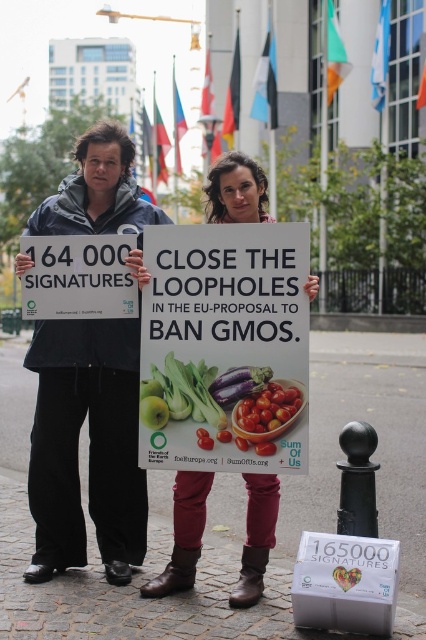
Between matte plastic sign at center and green matte apple at center, which one appears on the left side from the viewer's perspective?

Positioned to the left is green matte apple at center.

Is point (307, 426) closer to camera compared to point (166, 417)?

Yes, point (307, 426) is in front of point (166, 417).

Is point (287, 339) more distant than point (154, 408)?

No, it is in front of (154, 408).

The height and width of the screenshot is (640, 426). In order to click on matte plastic sign at center in this screenshot , I will do `click(226, 348)`.

Does matte plastic sign at center appear on the right side of matte purple eggplant at center?

In fact, matte plastic sign at center is to the left of matte purple eggplant at center.

Which is behind, point (230, 259) or point (236, 378)?

The point (230, 259) is more distant.

I want to click on matte plastic sign at center, so click(x=226, y=348).

Is shiny red tomatoes at center shorter than matte purple eggplant at center?

Incorrect, shiny red tomatoes at center's height does not fall short of matte purple eggplant at center's.

Which is below, shiny red tomatoes at center or matte purple eggplant at center?

Positioned lower is shiny red tomatoes at center.

Which is in front, point (250, 428) or point (212, 388)?

Point (250, 428) is more forward.

Find the location of `shiny red tomatoes at center`. shiny red tomatoes at center is located at coordinates (267, 408).